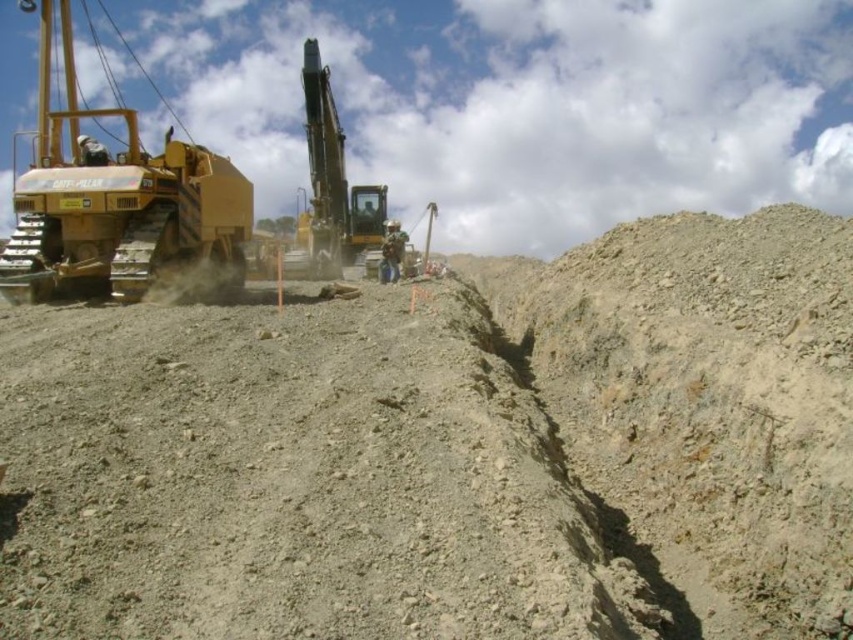
Between point (190, 220) and point (305, 244), which one is positioned in front?

Point (190, 220)

Who is lower down, matte yellow bulldozer at left or yellow metallic excavator at center?

yellow metallic excavator at center is below.

Which is in front, point (184, 157) or point (364, 196)?

Point (184, 157) is in front.

Where is `matte yellow bulldozer at left`? This screenshot has width=853, height=640. matte yellow bulldozer at left is located at coordinates (119, 204).

Does yellow metallic excavator at center appear on the left side of camouflage fabric construction worker at center?

Indeed, yellow metallic excavator at center is positioned on the left side of camouflage fabric construction worker at center.

Is yellow metallic excavator at center positioned at the back of camouflage fabric construction worker at center?

Yes.

Which is behind, point (312, 232) or point (399, 246)?

The point (312, 232) is behind.

Find the location of a particular element. yellow metallic excavator at center is located at coordinates (329, 189).

Is matte yellow bulldozer at left smaller than camouflage fabric construction worker at center?

Actually, matte yellow bulldozer at left might be larger than camouflage fabric construction worker at center.

Can you confirm if matte yellow bulldozer at left is shorter than camouflage fabric construction worker at center?

In fact, matte yellow bulldozer at left may be taller than camouflage fabric construction worker at center.

This screenshot has width=853, height=640. What do you see at coordinates (119, 204) in the screenshot?
I see `matte yellow bulldozer at left` at bounding box center [119, 204].

The height and width of the screenshot is (640, 853). What are the coordinates of `matte yellow bulldozer at left` in the screenshot? It's located at (119, 204).